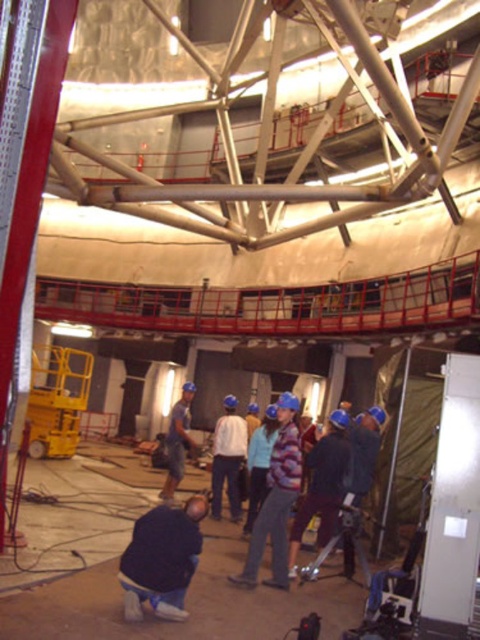
You are an inspector at the construction site. You need to determine if the dark blue jeans at lower center can fit inside the blue hard hat at center. Can they?

The dark blue jeans at lower center has a smaller size compared to blue hard hat at center, so yes, the dark blue jeans at lower center can fit inside the blue hard hat at center.

You are an inspector standing at the entrance of the telescope dome. You need to locate the white matte shirt at center. Based on the coordinates provided, where would you find it in the image?

The white matte shirt at center is located at the coordinates point (228, 458) in the image.

You are an engineer standing at the center of the telescope dome. You need to inspect two points marked in the scene. The first point is at coordinates point (236, 444) and the second is at point (179, 410). From your current position, which point is closer to you?

Point (236, 444) is in front of point (179, 410), so the first point is closer to you.